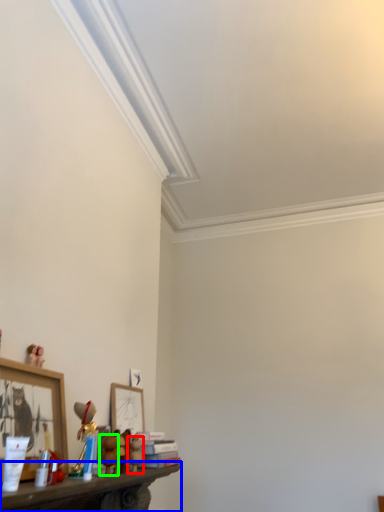
Question: Based on their relative distances, which object is nearer to toy (highlighted by a red box)? Choose from shelf (highlighted by a blue box) and toy (highlighted by a green box).

Choices:
 (A) shelf
 (B) toy

Answer: (B)